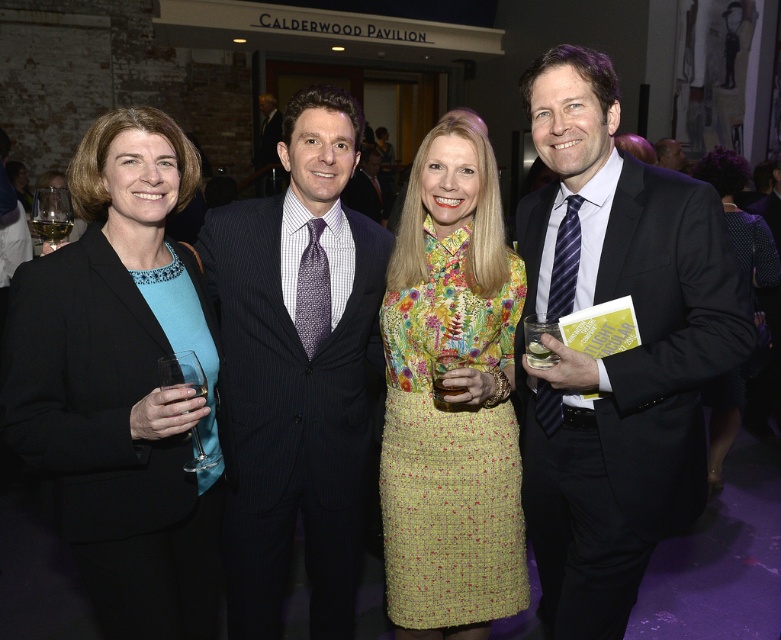
You are standing in front of the group of four people at the formal event. You notice two points marked in the image. The first point is at coordinate (102, 401) and the second is at (302, 209). Which of these two points is closer to you?

Point (102, 401) is closer to the viewer than point (302, 209).

You are at a party and want to take a photo with the polka dot dress at center and the matte black suit at center. To ensure both are in frame, should you position yourself to the left or right of the two?

You should position yourself to the right of the polka dot dress at center and matte black suit at center because the polka dot dress at center is to the left of the matte black suit at center, so placing yourself to their right would keep both in the frame.

You are at a formal event and need to find the dark blue pinstripe suit at center. Is it behind or in front of the black fabric blazer at left?

The black fabric blazer at left is in front of the dark blue pinstripe suit at center, so the dark blue pinstripe suit at center is behind the black fabric blazer at left.